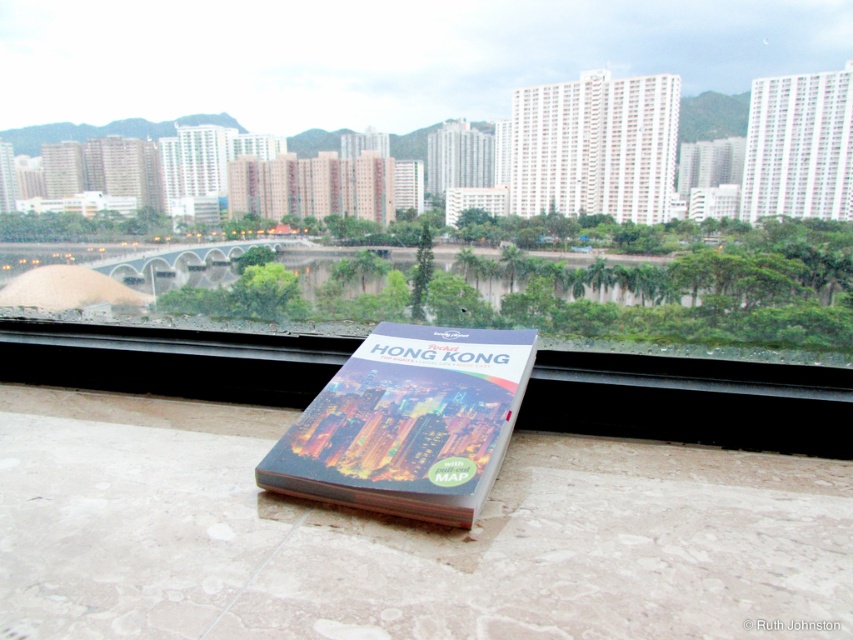
You are standing on the balcony and want to place a rectangular photo frame that is 10 cm wide. You have two options for placement spots on the tiled surface. One spot is where the white tile at lower center is located, and the other is where the matte plastic hong kong guidebook at center is currently placed. Which location can definitely accommodate the photo frame without overlapping the edges?

The white tile at lower center might be wider than the matte plastic hong kong guidebook at center. Since the photo frame is 10 cm wide, if the white tile at lower center is indeed wider, it can definitely accommodate the frame. However, the matte plastic hong kong guidebook at center may not have enough space. Therefore, the white tile at lower center is the safer choice.

You are standing on a balcony and see the white tile at lower center and the matte plastic hong kong guidebook at center. Which object is located more to the left?

The white tile at lower center is positioned on the left side of matte plastic hong kong guidebook at center, so it is more to the left.

Consider the image. You are standing on the balcony and want to place a small potted plant between the white tile at lower center and the matte plastic hong kong guidebook at center. Considering their sizes, will the potted plant fit comfortably between them?

The white tile at lower center has a larger size compared to the matte plastic hong kong guidebook at center. Since the white tile is bigger, there should be enough space to place the potted plant between them comfortably.